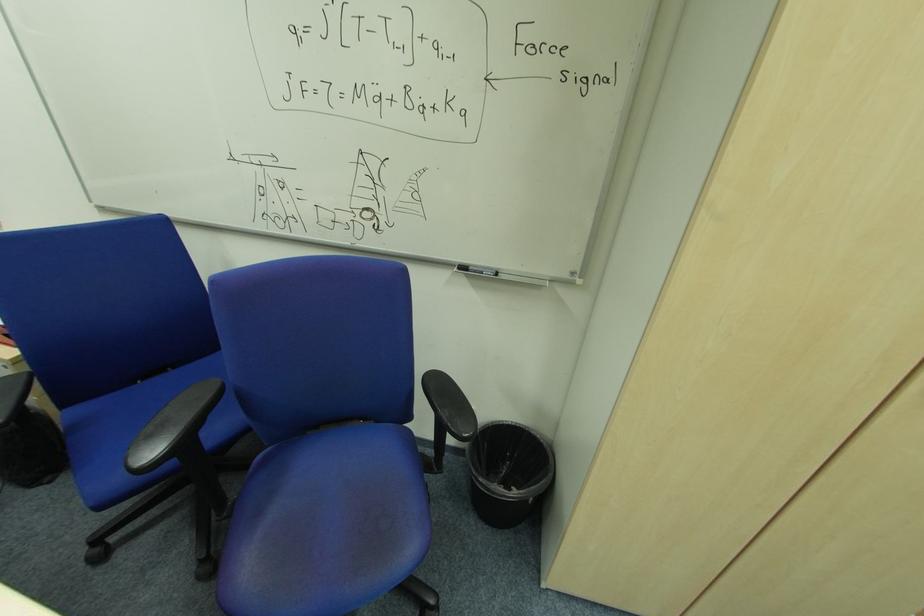
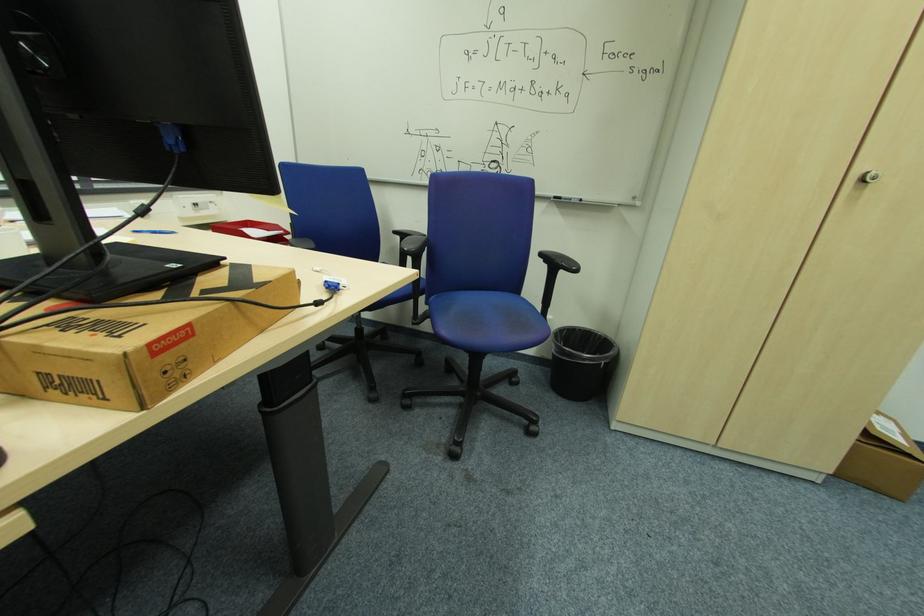
What movement of the cameraman would produce the second image?

The movement direction of the cameraman is left, backward.